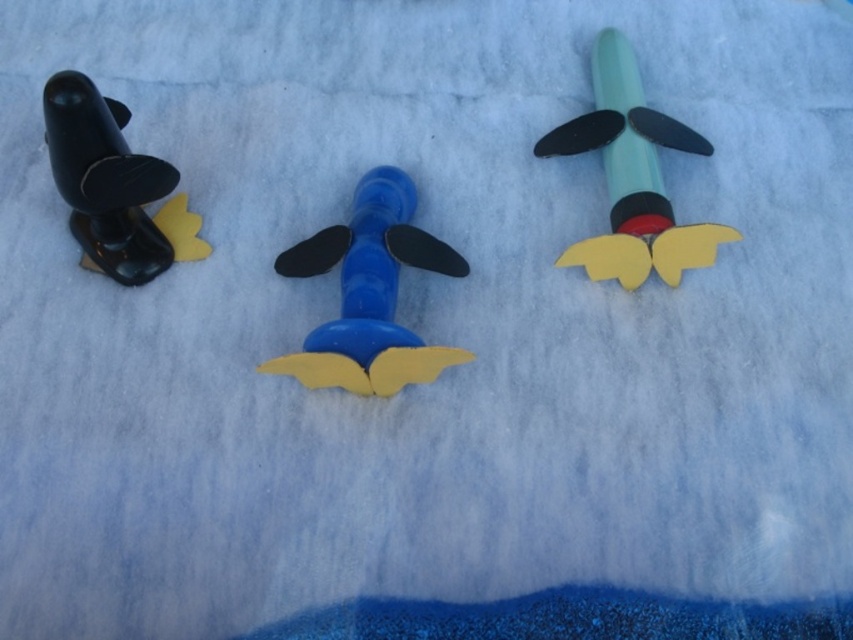
Which is more to the left, matte green rocket at upper right or matte black rocket at left?

From the viewer's perspective, matte black rocket at left appears more on the left side.

Is matte green rocket at upper right below matte black rocket at left?

No, matte green rocket at upper right is not below matte black rocket at left.

At what (x,y) coordinates should I click in order to perform the action: click on matte green rocket at upper right. Please return your answer as a coordinate pair (x, y). The height and width of the screenshot is (640, 853). Looking at the image, I should click on (631, 177).

Find the location of a particular element. Image resolution: width=853 pixels, height=640 pixels. matte green rocket at upper right is located at coordinates (631, 177).

How much distance is there between blue matte airplane at center and matte black rocket at left?

blue matte airplane at center is 21.13 centimeters away from matte black rocket at left.

Is blue matte airplane at center smaller than matte black rocket at left?

No, blue matte airplane at center is not smaller than matte black rocket at left.

Does point (347, 324) come closer to viewer compared to point (144, 157)?

Yes, point (347, 324) is in front of point (144, 157).

Locate an element on the screen. The height and width of the screenshot is (640, 853). blue matte airplane at center is located at coordinates (369, 292).

Does blue matte airplane at center come in front of matte green rocket at upper right?

Yes.

Does point (386, 256) come closer to viewer compared to point (700, 241)?

No, (386, 256) is further to viewer.

This screenshot has height=640, width=853. I want to click on blue matte airplane at center, so click(369, 292).